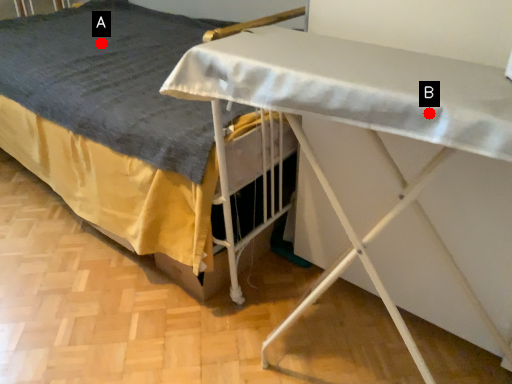
Question: Two points are circled on the image, labeled by A and B beside each circle. Which of the following is the farthest from the observer?

Choices:
 (A) A is further
 (B) B is further

Answer: (A)